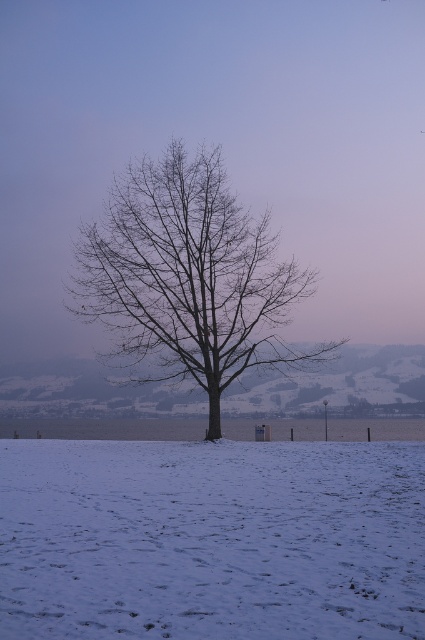
Does white powdery snow at center have a greater width compared to bare wood tree at center?

Indeed, white powdery snow at center has a greater width compared to bare wood tree at center.

Image resolution: width=425 pixels, height=640 pixels. What do you see at coordinates (210, 540) in the screenshot?
I see `white powdery snow at center` at bounding box center [210, 540].

Locate an element on the screen. white powdery snow at center is located at coordinates (210, 540).